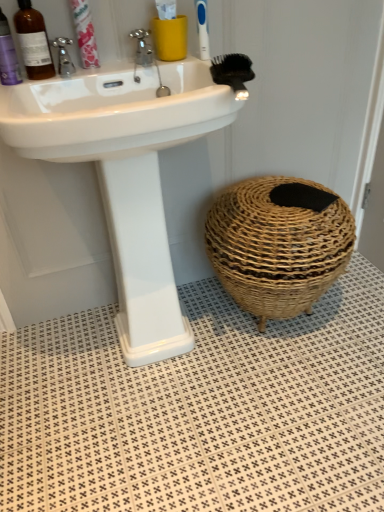
Question: From a real-world perspective, is brushed metal faucet at upper left, marked as the 2th tap in a right-to-left arrangement, physically below pink paper toothpaste at upper left?

Choices:
 (A) yes
 (B) no

Answer: (A)

Question: Is brushed metal faucet at upper left, marked as the 2th tap in a right-to-left arrangement, outside of pink paper toothpaste at upper left?

Choices:
 (A) yes
 (B) no

Answer: (A)

Question: Can you confirm if brushed metal faucet at upper left, marked as the 2th tap in a right-to-left arrangement, is positioned to the left of pink paper toothpaste at upper left?

Choices:
 (A) yes
 (B) no

Answer: (A)

Question: Is brushed metal faucet at upper left, marked as the 2th tap in a right-to-left arrangement, touching pink paper toothpaste at upper left?

Choices:
 (A) no
 (B) yes

Answer: (B)

Question: Does brushed metal faucet at upper left, marked as the 2th tap in a right-to-left arrangement, have a lesser width compared to pink paper toothpaste at upper left?

Choices:
 (A) yes
 (B) no

Answer: (B)

Question: In terms of size, does white textured tile at lower center appear bigger or smaller than white glossy sink at upper center?

Choices:
 (A) small
 (B) big

Answer: (A)

Question: Considering the positions of white textured tile at lower center and white glossy sink at upper center in the image, is white textured tile at lower center taller or shorter than white glossy sink at upper center?

Choices:
 (A) short
 (B) tall

Answer: (A)

Question: From the image's perspective, is white textured tile at lower center above or below white glossy sink at upper center?

Choices:
 (A) below
 (B) above

Answer: (A)

Question: Is white textured tile at lower center situated inside white glossy sink at upper center or outside?

Choices:
 (A) outside
 (B) inside

Answer: (A)

Question: Considering their positions, is pink paper toothpaste at upper left located in front of or behind matte purple bottle at left, which appears as the first mouthwash when viewed from the left?

Choices:
 (A) behind
 (B) front

Answer: (A)

Question: From their relative heights in the image, would you say pink paper toothpaste at upper left is taller or shorter than matte purple bottle at left, which appears as the first mouthwash when viewed from the left?

Choices:
 (A) short
 (B) tall

Answer: (B)

Question: Looking at their shapes, would you say pink paper toothpaste at upper left is wider or thinner than matte purple bottle at left, which appears as the first mouthwash when viewed from the left?

Choices:
 (A) thin
 (B) wide

Answer: (A)

Question: Is pink paper toothpaste at upper left bigger or smaller than matte purple bottle at left, which appears as the first mouthwash when viewed from the left?

Choices:
 (A) big
 (B) small

Answer: (B)

Question: In the image, is matte purple bottle at left, which appears as the first mouthwash when viewed from the left, on the left side or the right side of matte yellow cup at upper center?

Choices:
 (A) right
 (B) left

Answer: (B)

Question: Do you think matte purple bottle at left, which appears as the first mouthwash when viewed from the left, is within matte yellow cup at upper center, or outside of it?

Choices:
 (A) outside
 (B) inside

Answer: (A)